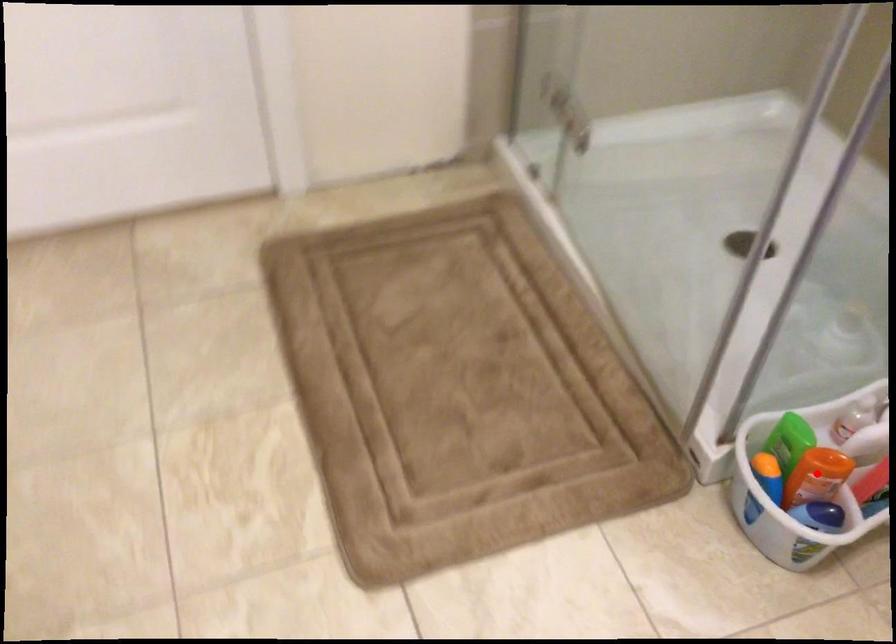
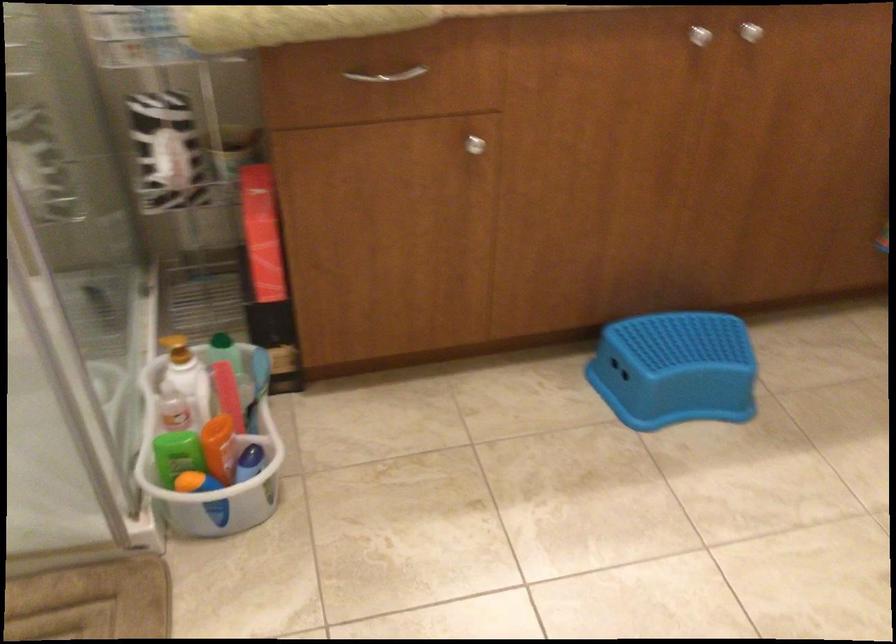
In the second image, find the point that corresponds to the highlighted location in the first image.

(220, 448)